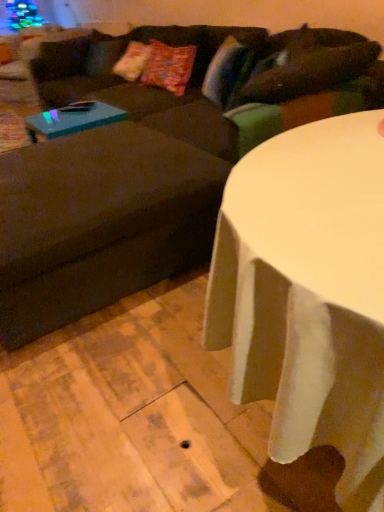
Question: Considering the positions of brown fabric swivel chair at left and dark brown fabric couch at upper center in the image, is brown fabric swivel chair at left bigger or smaller than dark brown fabric couch at upper center?

Choices:
 (A) small
 (B) big

Answer: (A)

Question: Is point (1, 338) positioned closer to the camera than point (360, 51)?

Choices:
 (A) closer
 (B) farther

Answer: (A)

Question: Estimate the real-world distances between objects in this image. Which object is closer to the brown fabric swivel chair at left?

Choices:
 (A) dark brown fabric couch at upper center
 (B) white glossy table at center
 (C) teal glossy coffee table at left

Answer: (A)

Question: Which object is positioned farthest from the teal glossy coffee table at left?

Choices:
 (A) white glossy table at center
 (B) brown fabric swivel chair at left
 (C) dark brown fabric couch at upper center

Answer: (A)